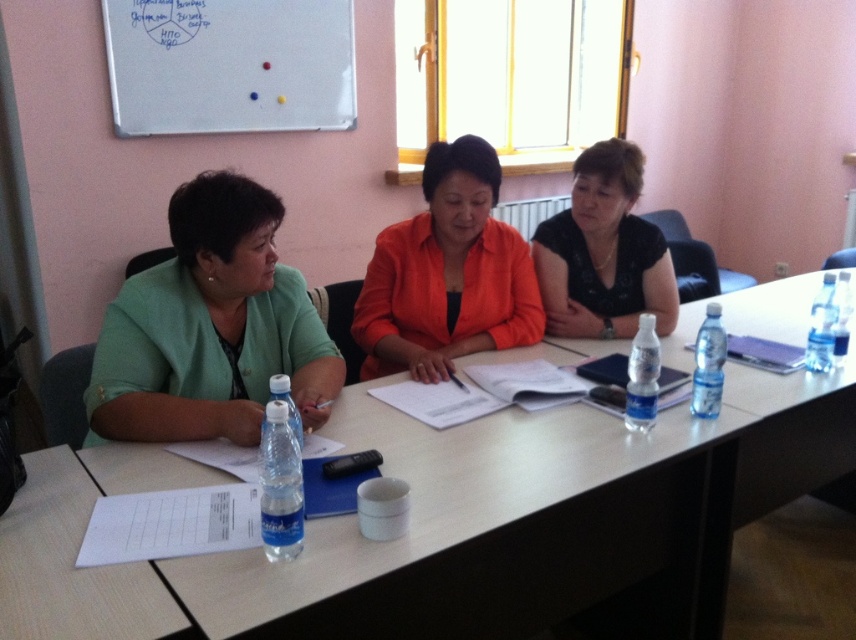
Does point (477, 589) come behind point (580, 220)?

No, it is in front of (580, 220).

Can you confirm if white glossy table at center is positioned above black matte shirt at center?

No.

The width and height of the screenshot is (856, 640). Describe the element at coordinates (484, 531) in the screenshot. I see `white glossy table at center` at that location.

The height and width of the screenshot is (640, 856). What are the coordinates of `white glossy table at center` in the screenshot? It's located at (x=484, y=531).

Can you confirm if white glossy table at center is positioned below whiteboard at upper left?

Correct, white glossy table at center is located below whiteboard at upper left.

Between white glossy table at center and whiteboard at upper left, which one is positioned lower?

white glossy table at center is lower down.

Where is `white glossy table at center`? Image resolution: width=856 pixels, height=640 pixels. white glossy table at center is located at coordinates (484, 531).

Which is behind, point (577, 486) or point (468, 177)?

Positioned behind is point (468, 177).

Does white glossy table at center have a greater width compared to orange matte jacket at center?

Yes, white glossy table at center is wider than orange matte jacket at center.

The height and width of the screenshot is (640, 856). What do you see at coordinates (484, 531) in the screenshot? I see `white glossy table at center` at bounding box center [484, 531].

You are a GUI agent. You are given a task and a screenshot of the screen. Output one action in this format:
    pyautogui.click(x=<x>, y=<y>)
    Task: Click on the white glossy table at center
    This screenshot has height=640, width=856.
    Given the screenshot: What is the action you would take?
    pyautogui.click(x=484, y=531)